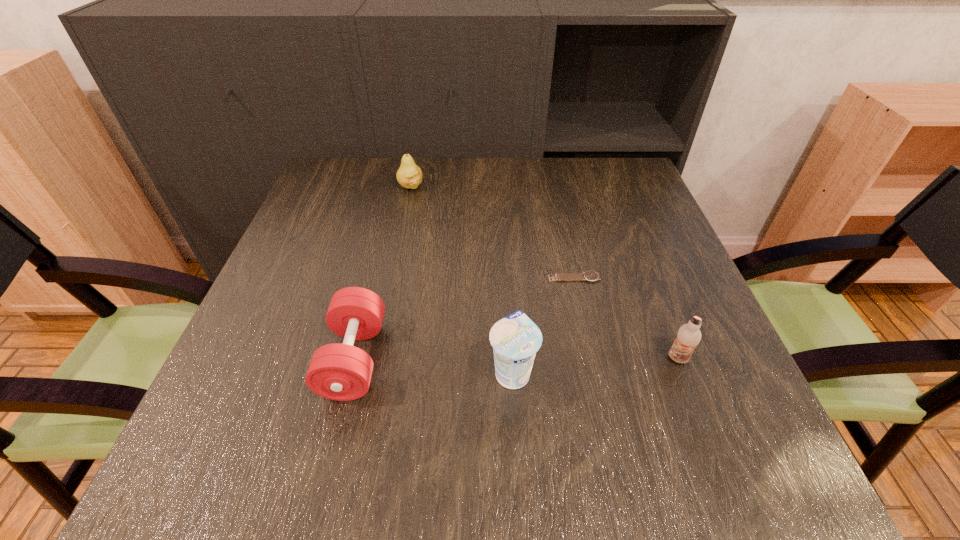
Identify the location of unoccupied position between the chocolate milk and the watch. The height and width of the screenshot is (540, 960). (626, 318).

Where is `free spot between the pear and the shortest object`? free spot between the pear and the shortest object is located at coordinates (492, 232).

At what (x,y) coordinates should I click in order to perform the action: click on vacant region between the fourth object from left to right and the pear. Please return your answer as a coordinate pair (x, y). The image size is (960, 540). Looking at the image, I should click on (492, 232).

This screenshot has height=540, width=960. In order to click on vacant space that is in between the second farthest object and the pear in this screenshot , I will do `click(492, 232)`.

The width and height of the screenshot is (960, 540). I want to click on free space between the third object from left to right and the farthest object, so click(x=462, y=279).

The width and height of the screenshot is (960, 540). I want to click on empty space that is in between the fourth object from left to right and the dumbbell, so click(x=464, y=318).

The width and height of the screenshot is (960, 540). What are the coordinates of `vacant area that lies between the dumbbell and the fourth object from left to right` in the screenshot? It's located at (464, 318).

I want to click on object identified as the fourth closest to the yogurt, so click(409, 175).

Locate an element on the screen. Image resolution: width=960 pixels, height=540 pixels. object that is the closest to the chocolate milk is located at coordinates (591, 276).

The image size is (960, 540). I want to click on vacant region that satisfies the following two spatial constraints: 1. on the back side of the dumbbell; 2. on the left side of the rightmost object, so click(x=354, y=359).